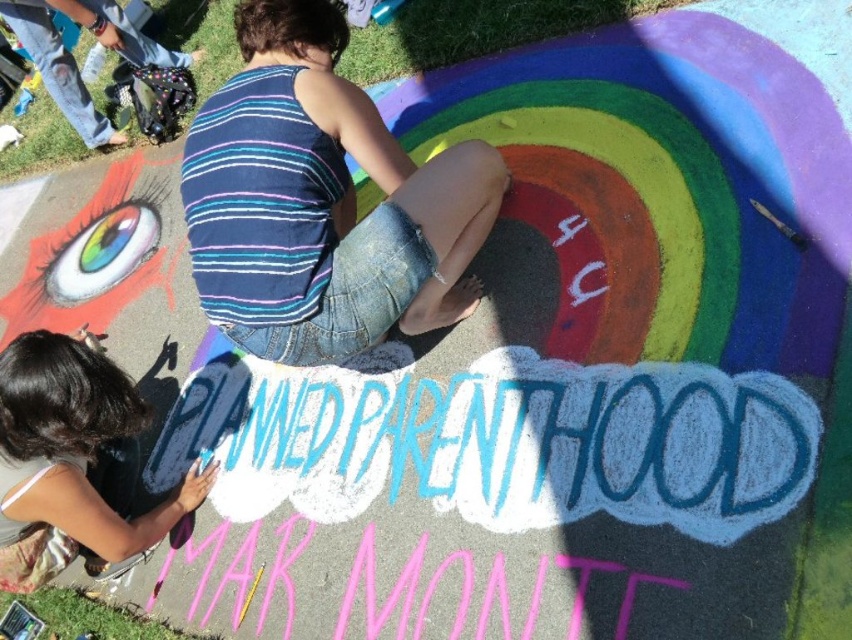
Question: Is the position of blue striped tank top at center less distant than that of smooth black hair at upper left?

Choices:
 (A) yes
 (B) no

Answer: (B)

Question: Which point appears closest to the camera in this image?

Choices:
 (A) (58, 456)
 (B) (436, 326)

Answer: (A)

Question: Can you confirm if blue striped tank top at center is positioned above smooth black hair at upper left?

Choices:
 (A) yes
 (B) no

Answer: (A)

Question: Which object appears farthest from the camera in this image?

Choices:
 (A) blue striped tank top at center
 (B) smooth black hair at upper left

Answer: (A)

Question: Does blue striped tank top at center have a greater width compared to smooth black hair at upper left?

Choices:
 (A) yes
 (B) no

Answer: (A)